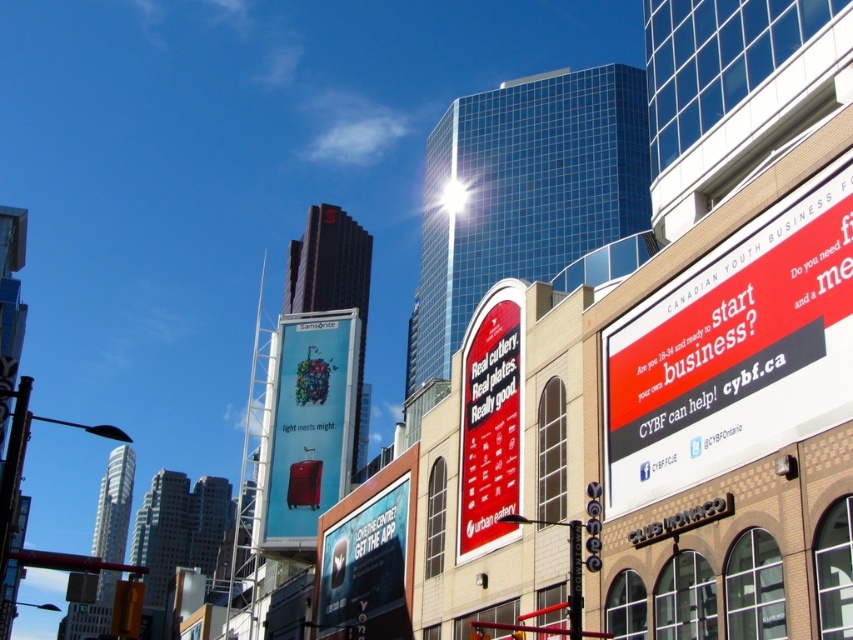
Question: Is the position of matte plastic suitcase at center less distant than that of white glossy billboard at center?

Choices:
 (A) no
 (B) yes

Answer: (A)

Question: Does red matte sign at center appear over white glossy billboard at center?

Choices:
 (A) no
 (B) yes

Answer: (B)

Question: Does red matte sign at center appear under white glossy billboard at center?

Choices:
 (A) yes
 (B) no

Answer: (B)

Question: Among these points, which one is farthest from the camera?

Choices:
 (A) (498, 336)
 (B) (302, 424)
 (C) (381, 636)

Answer: (B)

Question: Which object appears closest to the camera in this image?

Choices:
 (A) white glossy billboard at center
 (B) red matte sign at center
 (C) matte plastic suitcase at center

Answer: (B)

Question: Among these points, which one is nearest to the camera?

Choices:
 (A) (323, 545)
 (B) (276, 426)
 (C) (461, 550)

Answer: (C)